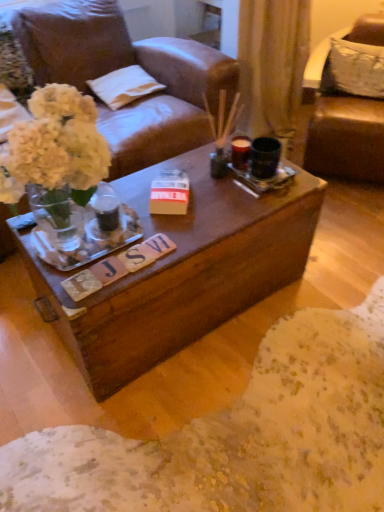
Question: Considering the relative sizes of white fabric pillow at upper right, acting as the second pillow starting from the left, and white cotton pillow at upper center, the 2th pillow viewed from the right, in the image provided, is white fabric pillow at upper right, acting as the second pillow starting from the left, bigger than white cotton pillow at upper center, the 2th pillow viewed from the right,?

Choices:
 (A) yes
 (B) no

Answer: (A)

Question: Is white fabric pillow at upper right, acting as the second pillow starting from the left, oriented away from white cotton pillow at upper center, the 2th pillow viewed from the right?

Choices:
 (A) no
 (B) yes

Answer: (A)

Question: Can you confirm if white fabric pillow at upper right, the first pillow viewed from the right, is thinner than white cotton pillow at upper center, the 2th pillow viewed from the right?

Choices:
 (A) no
 (B) yes

Answer: (B)

Question: Is white fabric pillow at upper right, acting as the second pillow starting from the left, in contact with white cotton pillow at upper center, which appears as the 1th pillow when viewed from the left?

Choices:
 (A) yes
 (B) no

Answer: (B)

Question: Would you say white fabric pillow at upper right, acting as the second pillow starting from the left, contains white cotton pillow at upper center, which appears as the 1th pillow when viewed from the left?

Choices:
 (A) yes
 (B) no

Answer: (B)

Question: Is white fabric pillow at upper right, acting as the second pillow starting from the left, at the right side of white cotton pillow at upper center, which appears as the 1th pillow when viewed from the left?

Choices:
 (A) no
 (B) yes

Answer: (B)

Question: Is white cotton pillow at upper center, the 2th pillow viewed from the right, thinner than brown leather chair at upper right?

Choices:
 (A) no
 (B) yes

Answer: (B)

Question: Can you confirm if white cotton pillow at upper center, the 2th pillow viewed from the right, is smaller than brown leather chair at upper right?

Choices:
 (A) yes
 (B) no

Answer: (A)

Question: Considering the relative sizes of white cotton pillow at upper center, the 2th pillow viewed from the right, and brown leather chair at upper right in the image provided, is white cotton pillow at upper center, the 2th pillow viewed from the right, taller than brown leather chair at upper right?

Choices:
 (A) no
 (B) yes

Answer: (A)

Question: From the image's perspective, would you say white cotton pillow at upper center, the 2th pillow viewed from the right, is shown under brown leather chair at upper right?

Choices:
 (A) no
 (B) yes

Answer: (A)

Question: Is the position of white cotton pillow at upper center, the 2th pillow viewed from the right, more distant than that of brown leather chair at upper right?

Choices:
 (A) yes
 (B) no

Answer: (A)

Question: Is white cotton pillow at upper center, the 2th pillow viewed from the right, positioned with its back to brown leather chair at upper right?

Choices:
 (A) no
 (B) yes

Answer: (A)

Question: From a real-world perspective, is brown leather chair at upper right physically above white cotton pillow at upper center, the 2th pillow viewed from the right?

Choices:
 (A) no
 (B) yes

Answer: (A)